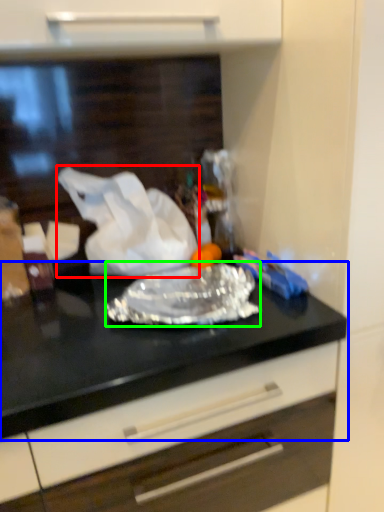
Question: Which is nearer to the wrapping paper (highlighted by a red box)? countertop (highlighted by a blue box) or wrap (highlighted by a green box).

Choices:
 (A) countertop
 (B) wrap

Answer: (B)